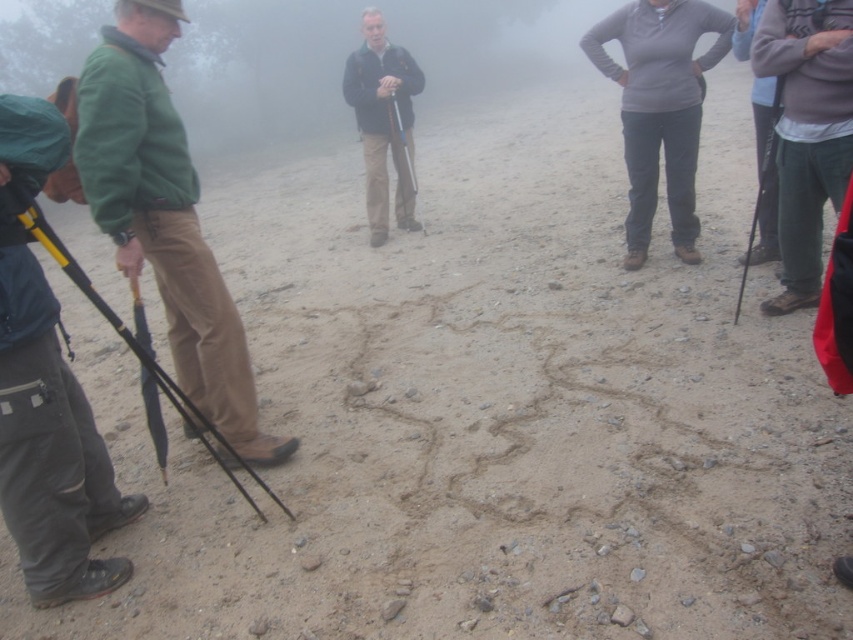
Measure the distance between gray matte pants at center and dark gray fleece at upper right.

They are 1.14 meters apart.

Between point (688, 125) and point (776, 38), which one is positioned in front?

Point (776, 38) is in front.

You are a GUI agent. You are given a task and a screenshot of the screen. Output one action in this format:
    pyautogui.click(x=<x>, y=<y>)
    Task: Click on the gray matte pants at center
    This screenshot has width=853, height=640.
    Given the screenshot: What is the action you would take?
    pyautogui.click(x=659, y=108)

What do you see at coordinates (164, 216) in the screenshot? I see `green fleece jacket at left` at bounding box center [164, 216].

Is green fleece jacket at left in front of matte black jacket at center?

Yes, it is.

Which is in front, point (233, 310) or point (386, 182)?

Point (233, 310) is in front.

You are a GUI agent. You are given a task and a screenshot of the screen. Output one action in this format:
    pyautogui.click(x=<x>, y=<y>)
    Task: Click on the green fleece jacket at left
    Image resolution: width=853 pixels, height=640 pixels.
    Given the screenshot: What is the action you would take?
    pyautogui.click(x=164, y=216)

Is point (370, 209) farther from camera compared to point (30, 211)?

Yes, it is.

Which of these two, matte black jacket at center or black rubber umbrella at left, stands shorter?

black rubber umbrella at left

The width and height of the screenshot is (853, 640). I want to click on matte black jacket at center, so click(x=380, y=109).